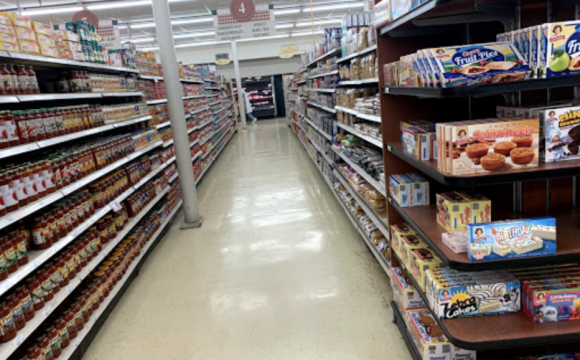
Identify the location of florescent lights. (333, 5), (300, 25), (304, 33), (193, 18), (192, 38), (211, 43).